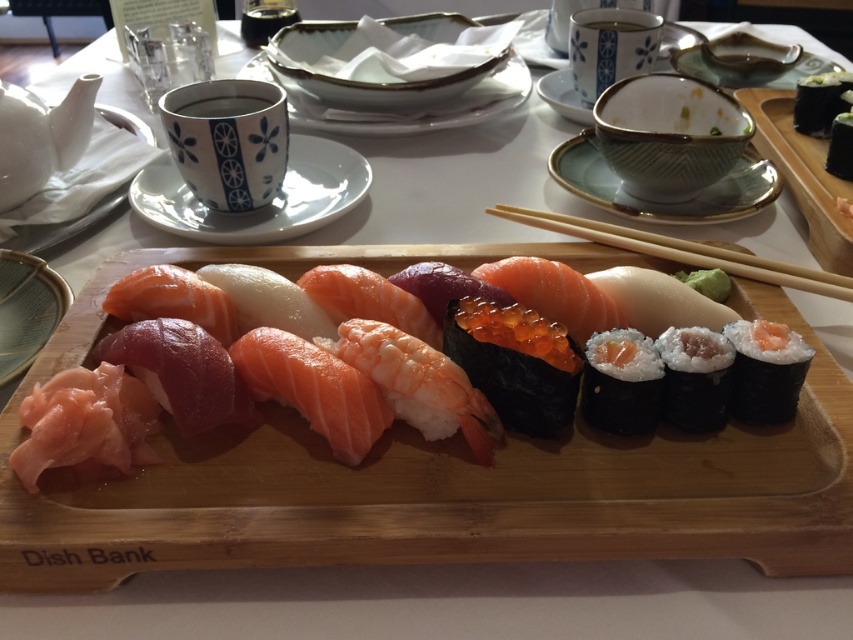
Can you confirm if porcelain bowl at upper right is wider than white rice at center?

Correct, the width of porcelain bowl at upper right exceeds that of white rice at center.

Where is `porcelain bowl at upper right`? The width and height of the screenshot is (853, 640). porcelain bowl at upper right is located at coordinates (663, 204).

You are a GUI agent. You are given a task and a screenshot of the screen. Output one action in this format:
    pyautogui.click(x=<x>, y=<y>)
    Task: Click on the porcelain bowl at upper right
    This screenshot has width=853, height=640.
    Given the screenshot: What is the action you would take?
    pyautogui.click(x=663, y=204)

Looking at this image, who is positioned more to the right, white porcelain plate at upper center or white rice at center?

Positioned to the right is white rice at center.

From the picture: Is white porcelain plate at upper center above white rice at center?

→ Correct, white porcelain plate at upper center is located above white rice at center.

Identify the location of white porcelain plate at upper center. The width and height of the screenshot is (853, 640). (395, 99).

Can you confirm if wooden tray at center is smaller than matte glass plate at lower left?

No, wooden tray at center is not smaller than matte glass plate at lower left.

Consider the image. Is wooden tray at center below matte glass plate at lower left?

Indeed, wooden tray at center is positioned under matte glass plate at lower left.

Does point (230, 248) come closer to viewer compared to point (0, 259)?

Yes, point (230, 248) is closer to viewer.

I want to click on wooden tray at center, so click(x=433, y=472).